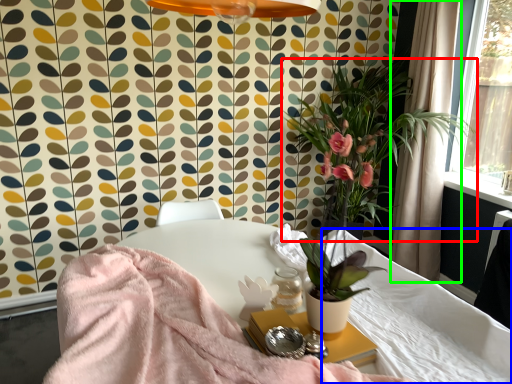
Question: Estimate the real-world distances between objects in this image. Which object is closer to houseplant (highlighted by a red box), mattress (highlighted by a blue box) or curtain (highlighted by a green box)?

Choices:
 (A) mattress
 (B) curtain

Answer: (B)